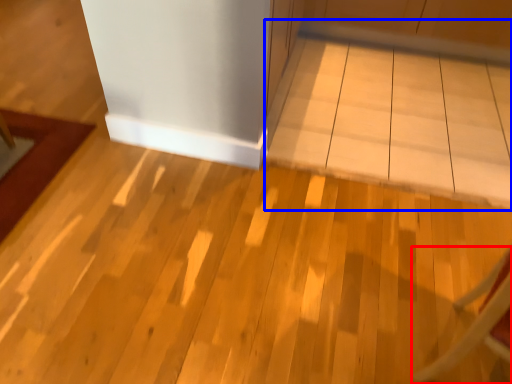
Question: Which object is closer to the camera taking this photo, furniture (highlighted by a red box) or table (highlighted by a blue box)?

Choices:
 (A) furniture
 (B) table

Answer: (A)